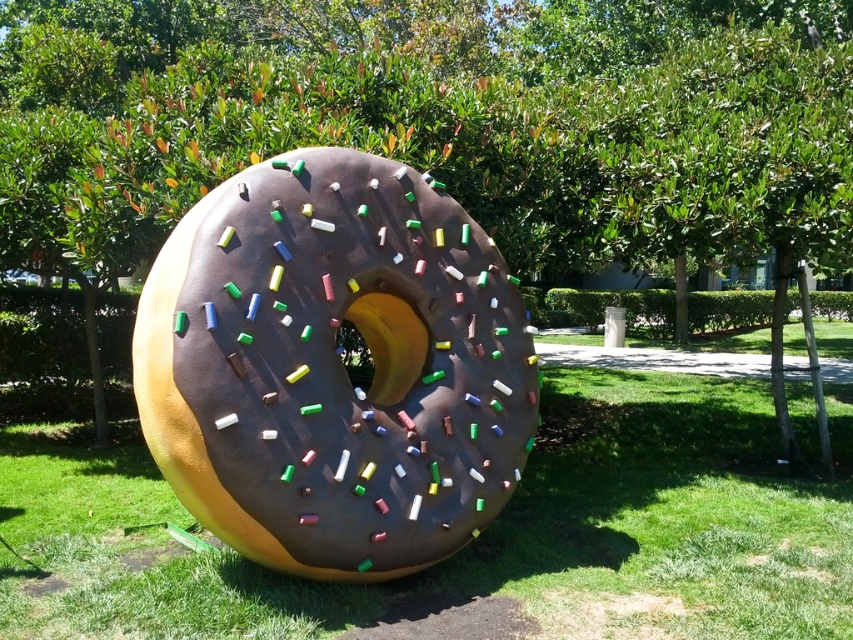
You are standing at the point with coordinates point (451, 124) in the image. What object are you standing on?

You are standing on the green leafy tree at center.